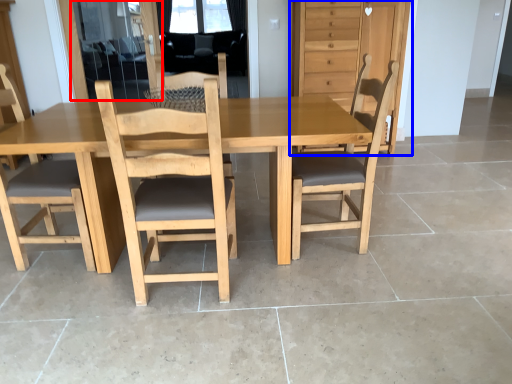
Question: Which object is closer to the camera taking this photo, screen door (highlighted by a red box) or dresser (highlighted by a blue box)?

Choices:
 (A) screen door
 (B) dresser

Answer: (B)